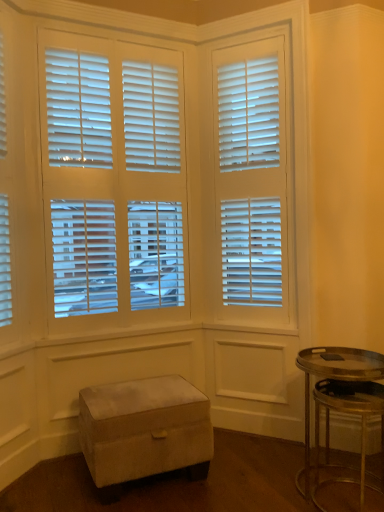
The width and height of the screenshot is (384, 512). What are the coordinates of `empty space that is ontop of suede ottoman at lower left (from a real-world perspective)` in the screenshot? It's located at pos(140,392).